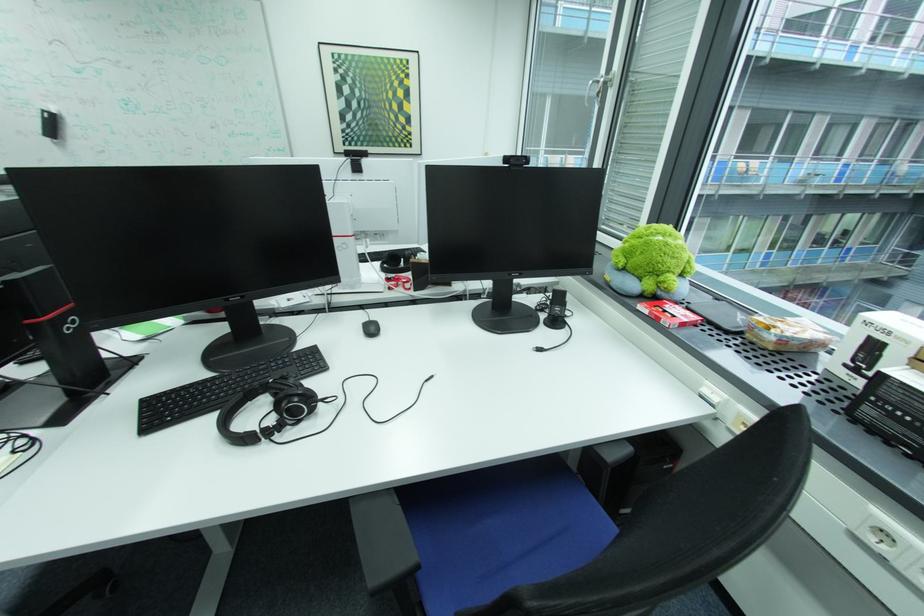
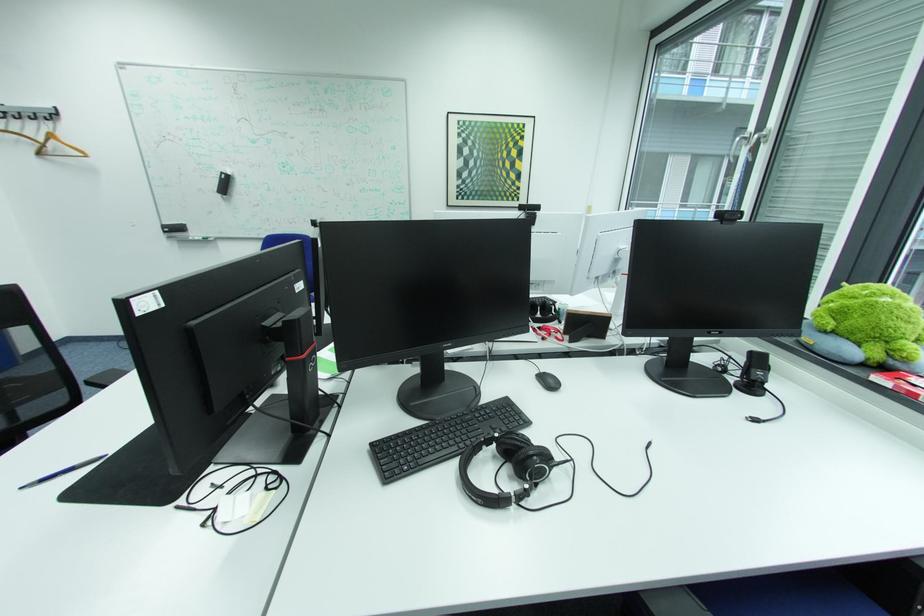
Find the pixel in the second image that matches pixel 533 161 in the first image.

(748, 217)